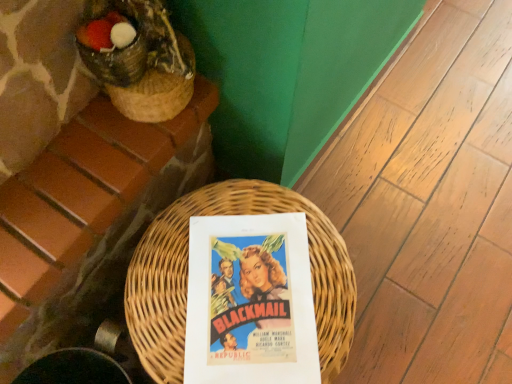
The height and width of the screenshot is (384, 512). Find the location of `empty space that is ontop of woven wicker basket at center (from a real-world perspective)`. empty space that is ontop of woven wicker basket at center (from a real-world perspective) is located at coordinates (237, 283).